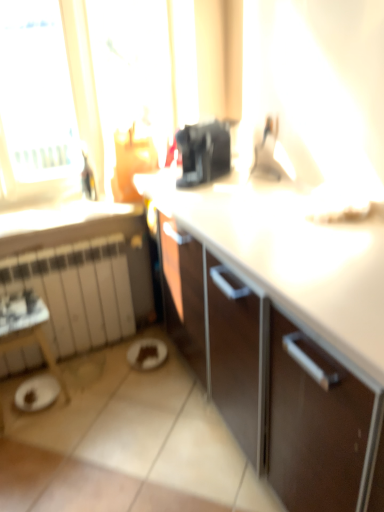
This screenshot has height=512, width=384. I want to click on vacant area that is in front of white matte radiator at lower left, so click(89, 414).